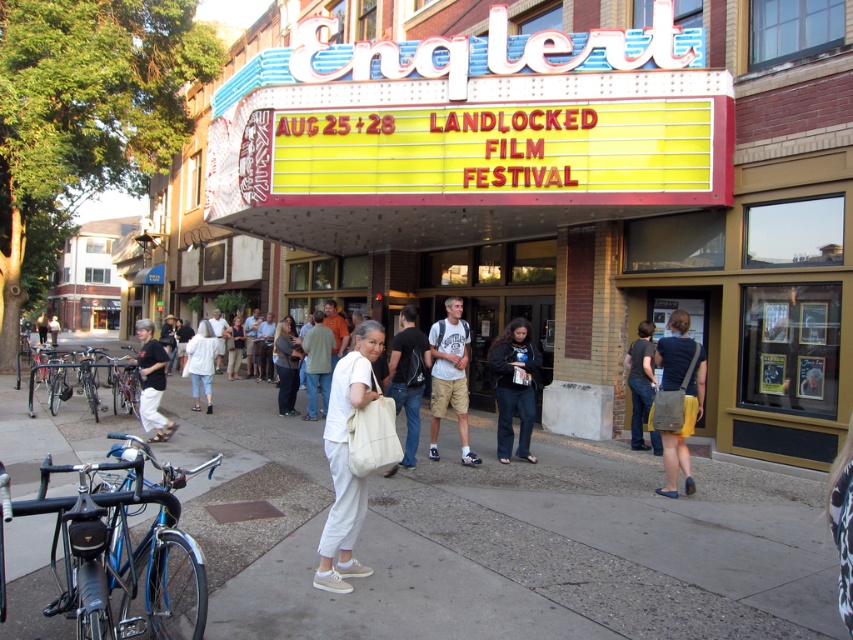
You are standing in front of the Englert Theatre at the Landlocked Film Festival. You notice two points marked on the ground in front of you. The first point is at coordinate (642, 392) and the second is at (315, 397). If you were to walk towards both points, which one would you reach first?

The point at coordinate (642, 392) is closer to you than the point at (315, 397), so you would reach the point at (642, 392) first.

You are a photographer standing at the entrance of the Englert Theatre. You want to take a photo of the crowd while ensuring the gray concrete sidewalk at center and the white cotton shirt at center are both visible. Which object should be closer to the camera to include both in the frame?

The gray concrete sidewalk at center is in front of the white cotton shirt at center, so to include both in the frame, the gray concrete sidewalk at center should be closer to the camera.

Consider the image. You are attending the Landlocked Film Festival at the Englert Theatre and notice a person wearing a dark blue shirt at center. Where exactly is this person positioned relative to the entrance?

The dark blue shirt at center is located at point coordinates of 0.592 on the x axis and 0.751 on the y axis, so the person is positioned slightly to the right and forward from the entrance.